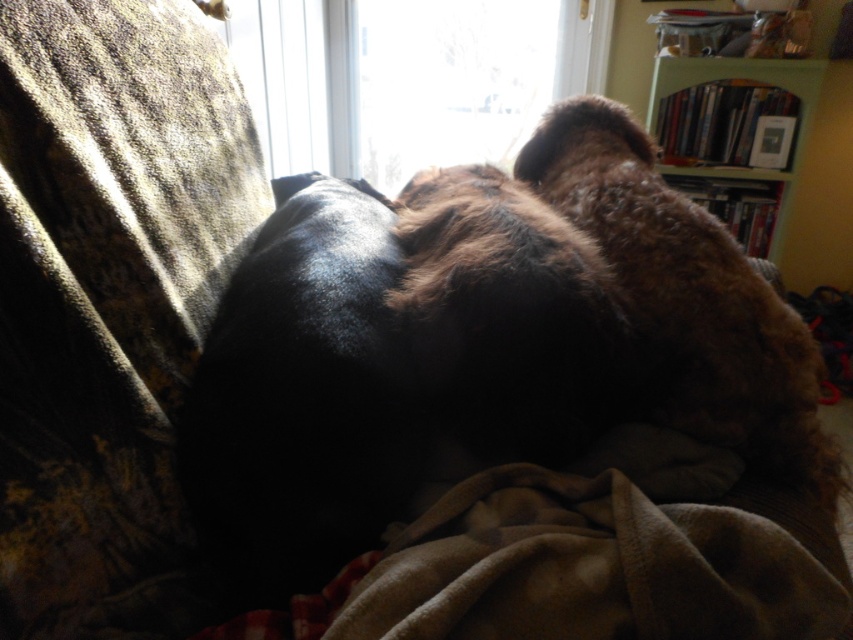
You are an interior designer planning to install a new ceiling fixture. You need to know which object, the transparent glass window at upper center or the green wood bookshelf at upper right, is taller to determine where to place the fixture. Which one is taller?

The transparent glass window at upper center has a greater height compared to the green wood bookshelf at upper right, so the window is taller.

You are a photographer standing at the camera position in the scene. You want to take a photo of the dog resting on the couch but need to ensure the transparent glass window at upper center won t be in the shot. What should you do?

The transparent glass window at upper center is 6.28 feet away from the camera. To avoid capturing it in the photo, move closer to the dog on the couch so that the window is out of the frame.

You are an interior designer planning to place a new sofa in the living room. The sofa must be smaller than the green wood bookshelf at upper right. Can the fuzzy brown dog at center fit on the new sofa?

The fuzzy brown dog at center is bigger than the green wood bookshelf at upper right. Since the new sofa must be smaller than the bookshelf, the sofa would not be large enough to accommodate the dog. The dog would not fit comfortably on the new sofa.